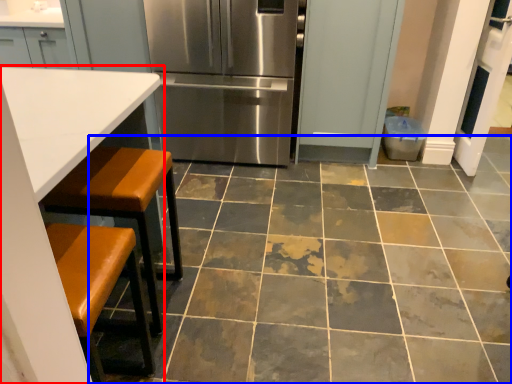
Question: Which object is further to the camera taking this photo, table (highlighted by a red box) or ceramic tile (highlighted by a blue box)?

Choices:
 (A) table
 (B) ceramic tile

Answer: (B)